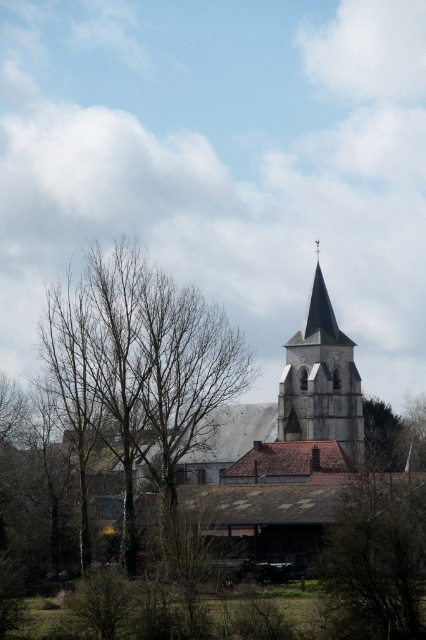
Does point (397, 534) come farther from viewer compared to point (324, 381)?

No, (397, 534) is closer to viewer.

Is brown wood tree at center below smooth gray steeple at center?

Correct, brown wood tree at center is located below smooth gray steeple at center.

Which is behind, point (380, 460) or point (310, 368)?

The point (380, 460) is behind.

This screenshot has width=426, height=640. Find the location of `brown wood tree at center`. brown wood tree at center is located at coordinates (377, 560).

Is bare wood tree at center below smooth gray steeple at center?

Yes.

Can you confirm if bare wood tree at center is positioned to the left of smooth gray steeple at center?

Correct, you'll find bare wood tree at center to the left of smooth gray steeple at center.

Is point (126, 483) positioned in front of point (354, 396)?

Yes, it is.

The height and width of the screenshot is (640, 426). In order to click on bare wood tree at center in this screenshot , I will do `click(152, 368)`.

Can you confirm if bare wood tree at center is positioned to the left of brown wood tree at center?

Correct, you'll find bare wood tree at center to the left of brown wood tree at center.

Is point (169, 324) positioned in front of point (420, 412)?

Yes, point (169, 324) is closer to viewer.

What do you see at coordinates (152, 368) in the screenshot?
I see `bare wood tree at center` at bounding box center [152, 368].

Where is `bare wood tree at center`? bare wood tree at center is located at coordinates (152, 368).